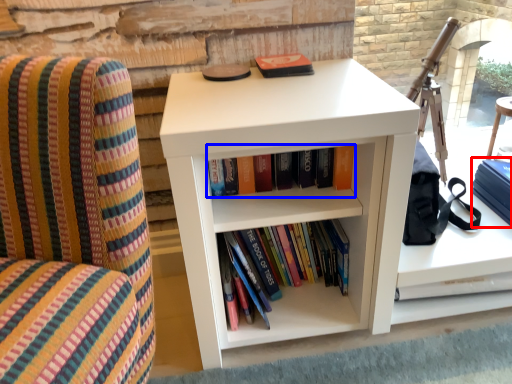
Question: Which object appears closest to the camera in this image, paperback book (highlighted by a red box) or book (highlighted by a blue box)?

Choices:
 (A) paperback book
 (B) book

Answer: (B)